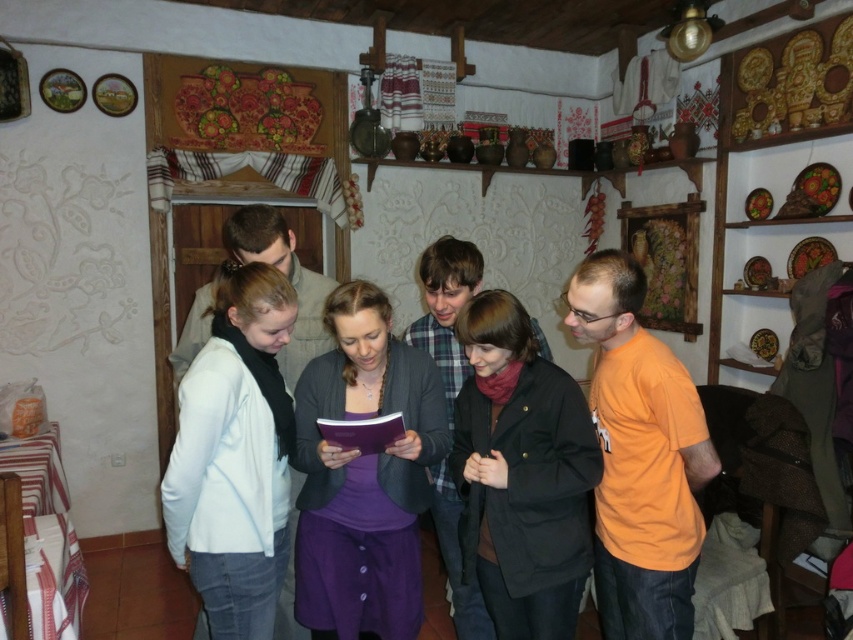
Does orange cotton shirt at center appear over purple matte sweater at center?

Correct, orange cotton shirt at center is located above purple matte sweater at center.

Between orange cotton shirt at center and purple matte sweater at center, which one has more height?

purple matte sweater at center is taller.

Is point (540, 499) closer to camera compared to point (485, 605)?

Yes, point (540, 499) is in front of point (485, 605).

Find the location of a particular element. The width and height of the screenshot is (853, 640). orange cotton shirt at center is located at coordinates (521, 472).

Is purple matte dress at center positioned in front of light blue fabric jacket at left?

No.

Based on the photo, is purple matte dress at center to the left of light blue fabric jacket at left from the viewer's perspective?

In fact, purple matte dress at center is to the right of light blue fabric jacket at left.

What do you see at coordinates (364, 474) in the screenshot?
I see `purple matte dress at center` at bounding box center [364, 474].

The width and height of the screenshot is (853, 640). What are the coordinates of `purple matte dress at center` in the screenshot? It's located at (364, 474).

Based on the photo, does purple matte dress at center appear on the right side of orange cotton t-shirt at right?

In fact, purple matte dress at center is to the left of orange cotton t-shirt at right.

Is purple matte dress at center above orange cotton t-shirt at right?

No, purple matte dress at center is not above orange cotton t-shirt at right.

Find the location of a particular element. The image size is (853, 640). purple matte dress at center is located at coordinates (364, 474).